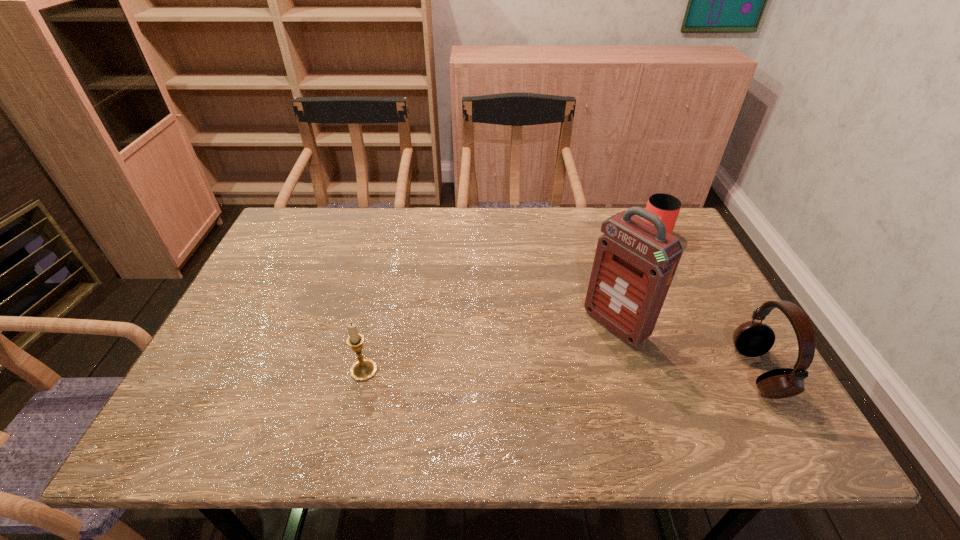
Find the location of `vacant space situated on the ear pads of the headset`. vacant space situated on the ear pads of the headset is located at coordinates (632, 372).

Locate an element on the screen. free space located on the handle side of the farthest object is located at coordinates (639, 284).

You are a GUI agent. You are given a task and a screenshot of the screen. Output one action in this format:
    pyautogui.click(x=<x>, y=<y>)
    Task: Click on the vacant position located 0.230m on the handle side of the farthest object
    
    Given the screenshot: What is the action you would take?
    pyautogui.click(x=635, y=295)

Locate an element on the screen. This screenshot has width=960, height=540. vacant space located 0.380m on the handle side of the farthest object is located at coordinates (618, 333).

This screenshot has height=540, width=960. Identify the location of vacant space located 0.260m on the front-facing side of the tallest object. click(x=515, y=400).

You are a GUI agent. You are given a task and a screenshot of the screen. Output one action in this format:
    pyautogui.click(x=<x>, y=<y>)
    Task: Click on the vacant space located on the front-facing side of the tallest object
    
    Given the screenshot: What is the action you would take?
    pyautogui.click(x=555, y=370)

The image size is (960, 540). Find the location of `vacant space located 0.100m on the front-facing side of the tallest object`. vacant space located 0.100m on the front-facing side of the tallest object is located at coordinates (567, 362).

The height and width of the screenshot is (540, 960). Identify the location of object that is at the far edge. (667, 207).

Locate an element on the screen. candle holder positioned at the near edge is located at coordinates (364, 369).

In order to click on headset located in the near edge section of the desktop in this screenshot , I will do `click(752, 339)`.